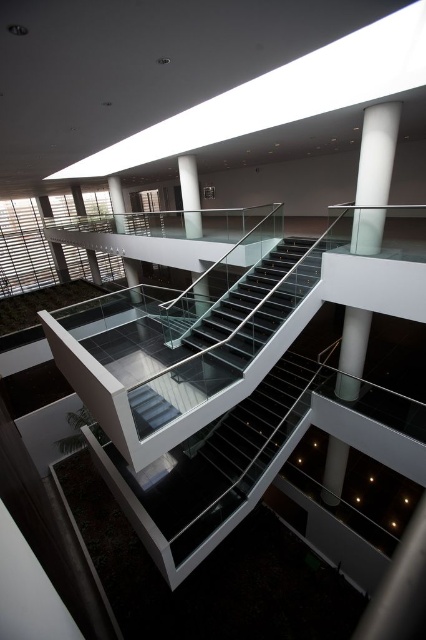
Is white glossy column at upper center above white glossy pillar at center?

Actually, white glossy column at upper center is below white glossy pillar at center.

Which is behind, point (379, 160) or point (115, 192)?

Point (115, 192)

Does point (370, 148) come in front of point (112, 188)?

Yes, it is.

Identify the location of white glossy column at upper center. (374, 177).

Where is `white glossy column at center`? The width and height of the screenshot is (426, 640). white glossy column at center is located at coordinates (189, 196).

Who is lower down, white glossy column at center or white glossy pillar at center?

white glossy column at center is below.

The image size is (426, 640). Identify the location of white glossy column at center. (189, 196).

Locate an element on the screen. The width and height of the screenshot is (426, 640). white glossy column at center is located at coordinates (189, 196).

Can you confirm if white glossy column at upper center is taller than white glossy column at center?

Correct, white glossy column at upper center is much taller as white glossy column at center.

Find the location of a particular element. The width and height of the screenshot is (426, 640). white glossy column at upper center is located at coordinates (374, 177).

The height and width of the screenshot is (640, 426). What do you see at coordinates (374, 177) in the screenshot?
I see `white glossy column at upper center` at bounding box center [374, 177].

The width and height of the screenshot is (426, 640). In order to click on white glossy column at upper center in this screenshot , I will do `click(374, 177)`.